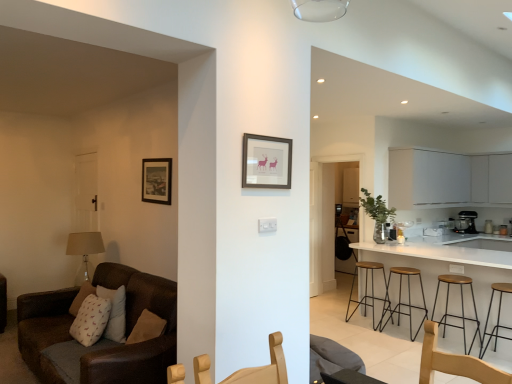
Question: From a real-world perspective, relative to brown leather couch at left, is wooden stool at lower right, placed as the fourth stool when sorted from back to front, vertically above or below?

Choices:
 (A) below
 (B) above

Answer: (A)

Question: Considering the relative positions of wooden stool at lower right, placed as the fourth stool when sorted from back to front, and brown leather couch at left in the image provided, is wooden stool at lower right, placed as the fourth stool when sorted from back to front, to the left or to the right of brown leather couch at left?

Choices:
 (A) left
 (B) right

Answer: (B)

Question: Considering the real-world distances, which object is farthest from the white matte cabinet at upper right?

Choices:
 (A) wooden stool at lower right, placed as the fourth stool when sorted from back to front
 (B) wooden seat stool at right, which is the third stool in back-to-front order
 (C) white glossy counter top at right
 (D) matte brown picture frame at center, which is the 2th picture frame from left to right
 (E) transparent glass door at center

Answer: (D)

Question: Which object is positioned farthest from the metallic silver blender at right?

Choices:
 (A) wooden seat stool at right, which is the third stool in back-to-front order
 (B) wooden stool at right, which is the first stool in back-to-front order
 (C) brown leather couch at left
 (D) white matte cabinet at upper right
 (E) wooden stool at lower right, placed as the fourth stool when sorted from back to front

Answer: (C)